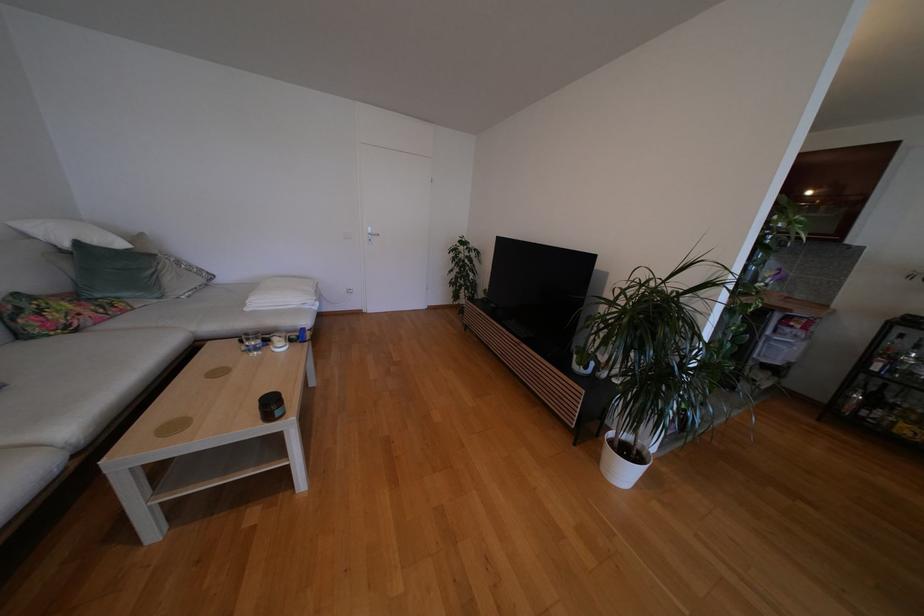
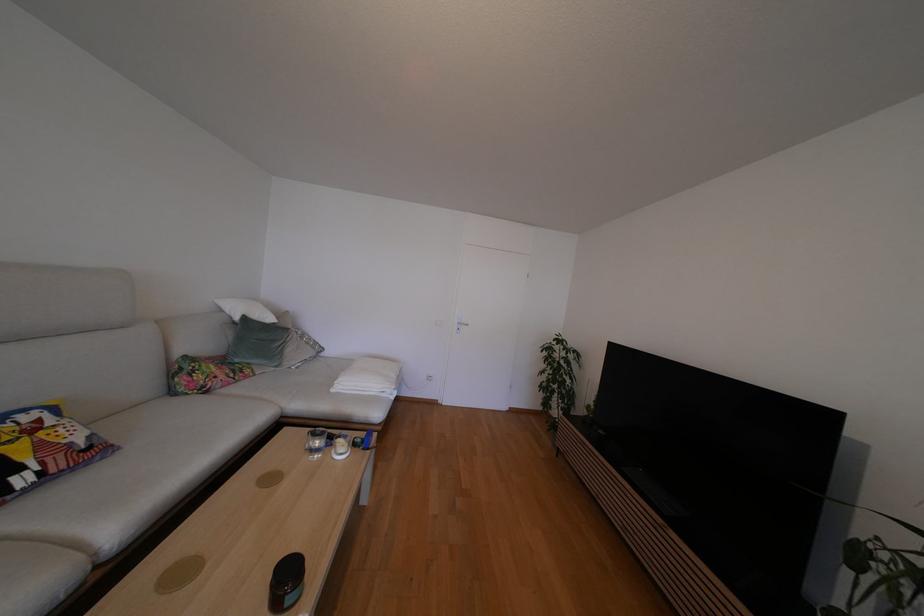
The point at (55, 305) is marked in the first image. Where is the corresponding point in the second image?

(207, 368)